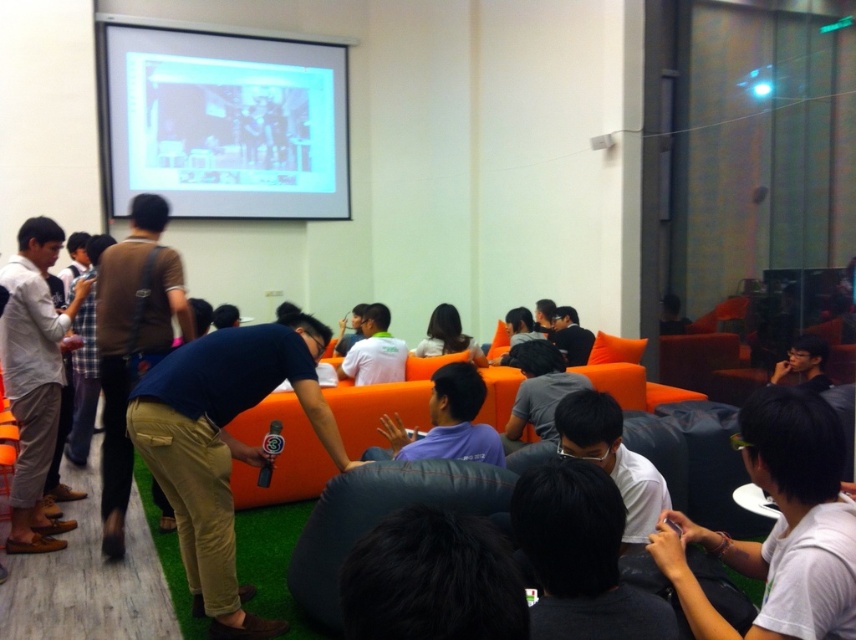
You are organizing a small event and need to seat two guests. You have a black fabric bean bag chair at lower center and a dark gray shirt at center available. Which seating option provides more horizontal space for comfort?

The black fabric bean bag chair at lower center is wider than the dark gray shirt at center, so it provides more horizontal space for comfort.

Looking at this image, you are organizing a small event and need to ensure that the black fabric bean bag chair at lower center can accommodate a guest wearing the dark gray shirt at center. Based on the image, will the bean bag chair be big enough?

The black fabric bean bag chair at lower center is larger in size than the dark gray shirt at center, so it should be big enough to accommodate a guest wearing the dark gray shirt at center.

You are organizing a photo shoot and need to ensure that all participants are visible in the frame. Given that the blue cotton shirt at center and the black matte shirt at upper right are part of the composition, which one might require more space in the frame due to its size?

The blue cotton shirt at center is bigger than the black matte shirt at upper right, so it would require more space in the frame to ensure visibility.